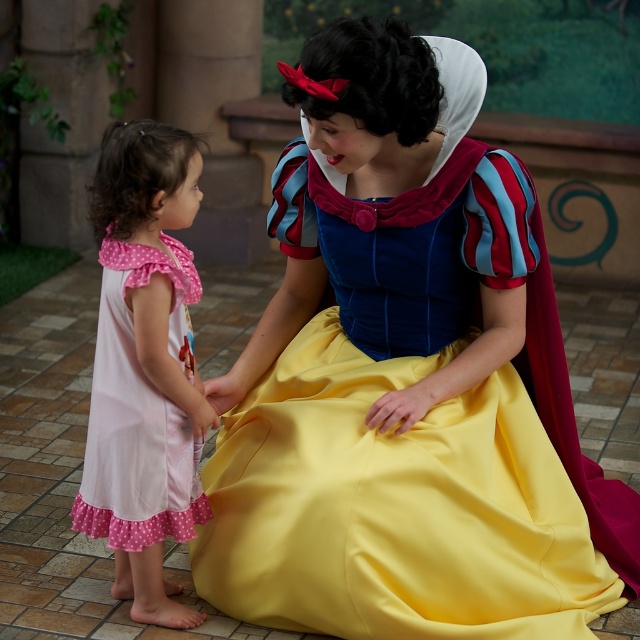
Question: Among these points, which one is farthest from the camera?

Choices:
 (A) (177, 481)
 (B) (401, 541)

Answer: (A)

Question: Observing the image, what is the correct spatial positioning of matte blue dress at center in reference to pink polka dot fabric dress at left?

Choices:
 (A) above
 (B) below

Answer: (A)

Question: Which of the following is the closest to the observer?

Choices:
 (A) pink polka dot fabric dress at left
 (B) matte blue dress at center

Answer: (B)

Question: Can you confirm if matte blue dress at center is positioned above pink polka dot fabric dress at left?

Choices:
 (A) yes
 (B) no

Answer: (A)

Question: Does matte blue dress at center have a lesser width compared to pink polka dot fabric dress at left?

Choices:
 (A) no
 (B) yes

Answer: (A)